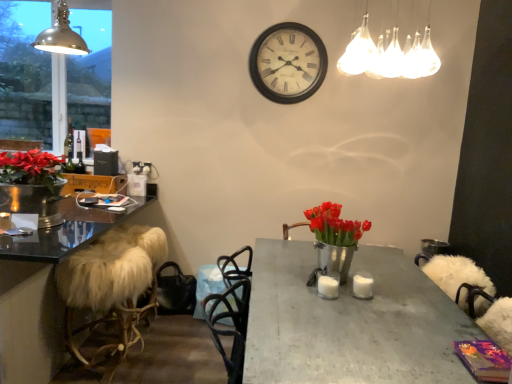
The width and height of the screenshot is (512, 384). I want to click on vacant area that lies to the right of white matte candle at center, which appears as the 1th candle when viewed from the left, so click(362, 292).